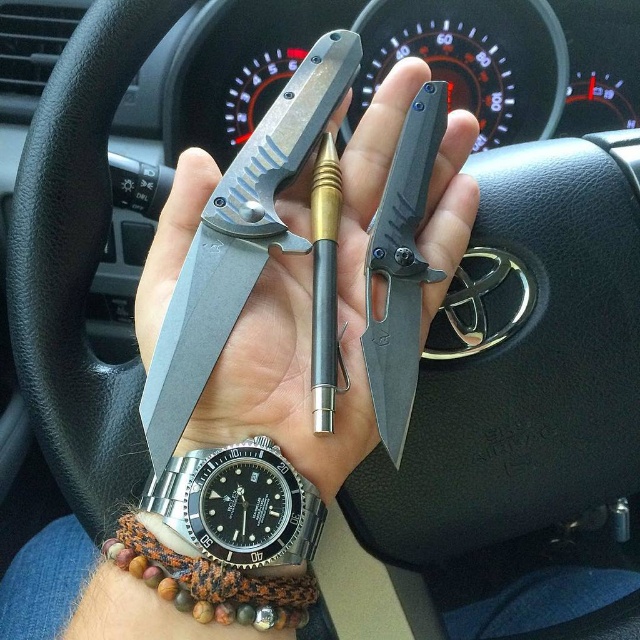
You need to choose an item to write with from the matte black knife at center and the satin steel watch at lower left. Which one is more likely to have a writing component?

The satin steel watch at lower left is more likely to have a writing component since watches can sometimes have built in pens or markers, while knives typically do not have writing tools.

You are a passenger in the car and want to reach for the satin steel watch at lower left and the black matte knife at center. Which object is located lower in the image?

The satin steel watch at lower left is located below the black matte knife at center, so it is the lower object.

You are a professional organizer assessing the space in a car. You have two items to place in a compartment that can only fit one item. The matte black knife at center and the satin steel watch at lower left are the options. Which item should you choose to ensure it fits?

The satin steel watch at lower left should be chosen because the matte black knife at center is wider, so the watch will fit better in the compartment.